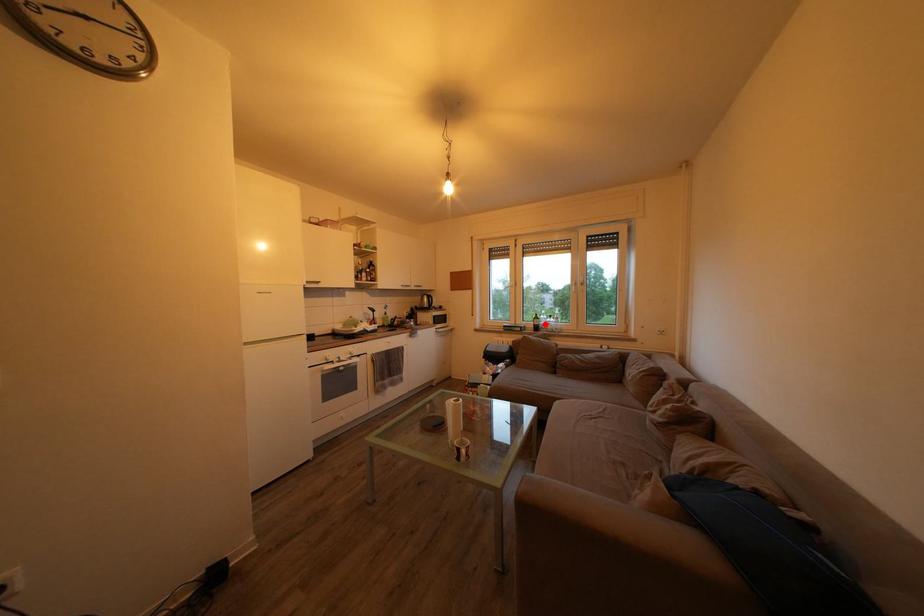
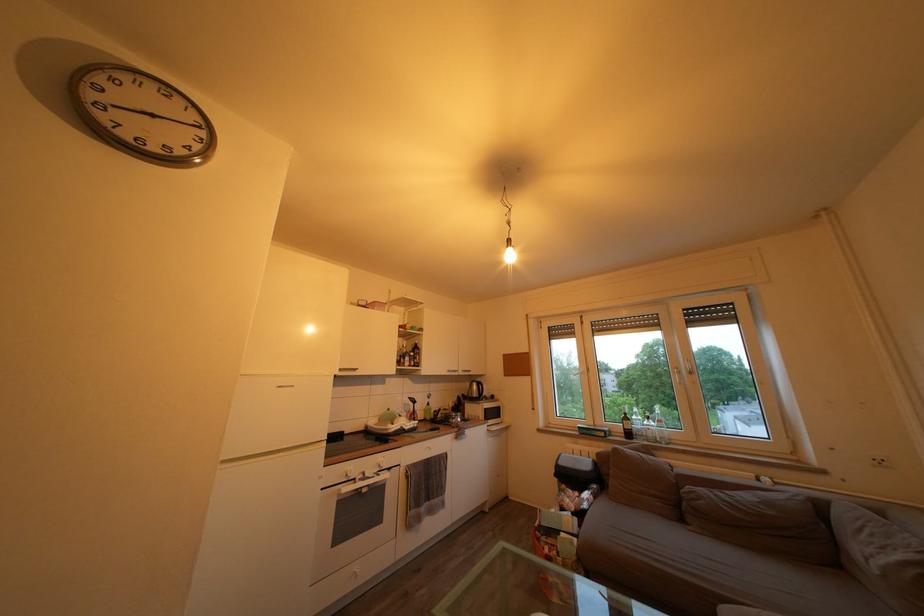
In the second image, find the point that corresponds to the highlighted location in the first image.

(635, 424)